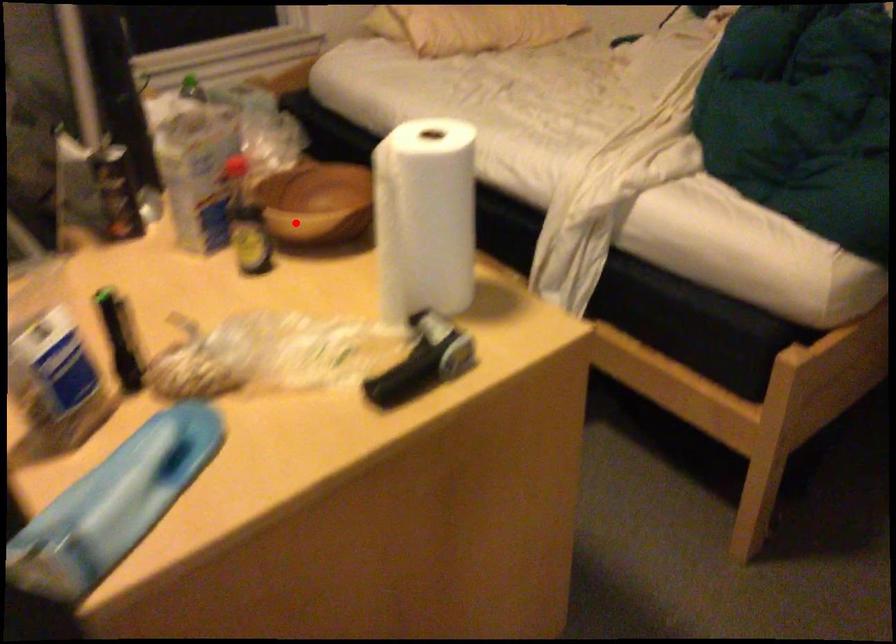
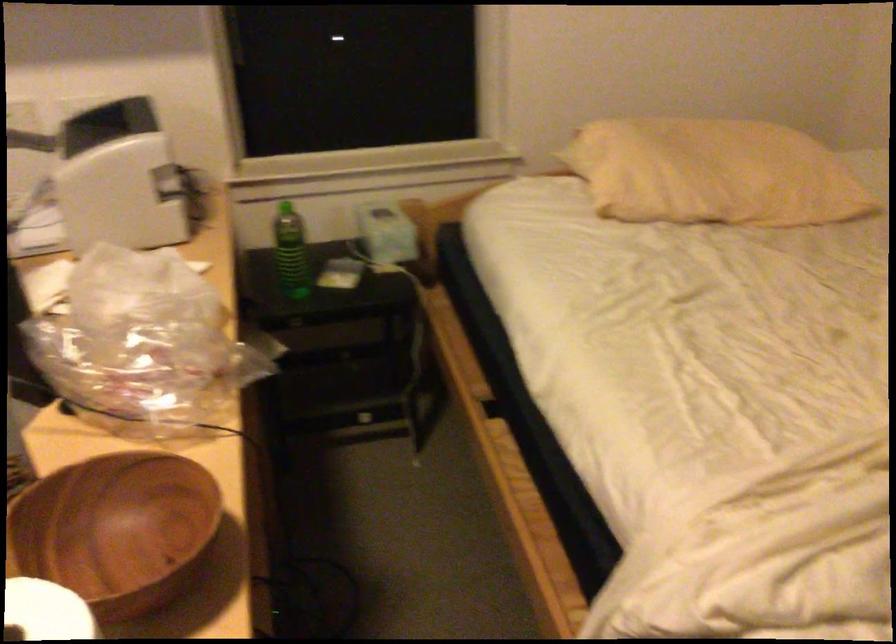
Question: A red point is marked in image1. In image2, is the corresponding 3D point closer to the camera or farther? Reply with the corresponding letter.

Choices:
 (A) The corresponding 3D point is closer.
 (B) The corresponding 3D point is farther.

Answer: (A)